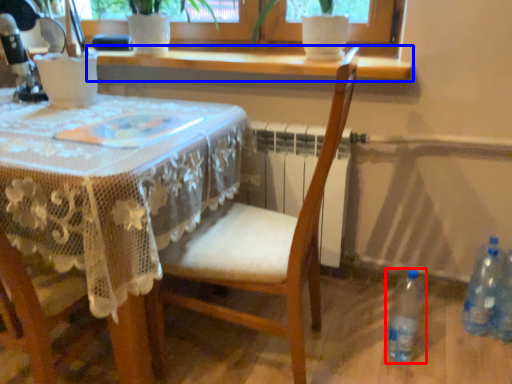
Question: Which of the following is the farthest to the observer, bottle (highlighted by a red box) or window sill (highlighted by a blue box)?

Choices:
 (A) bottle
 (B) window sill

Answer: (B)